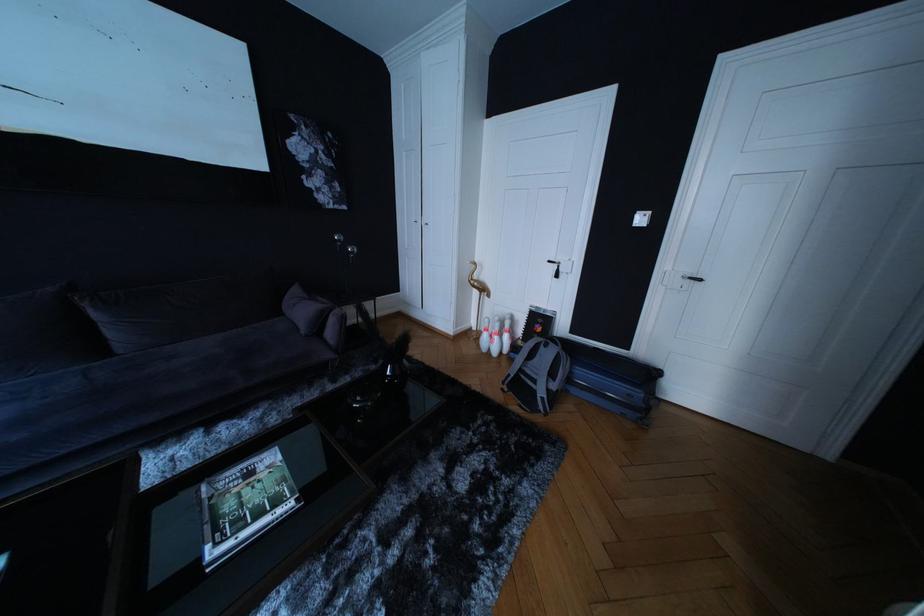
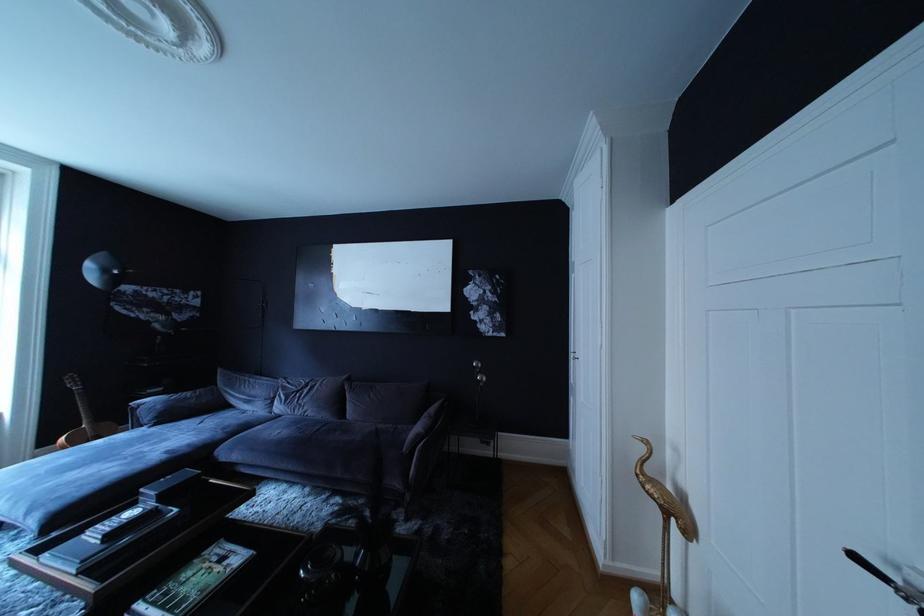
In the second image, find the point that corresponds to point 484,286 in the first image.

(660, 487)